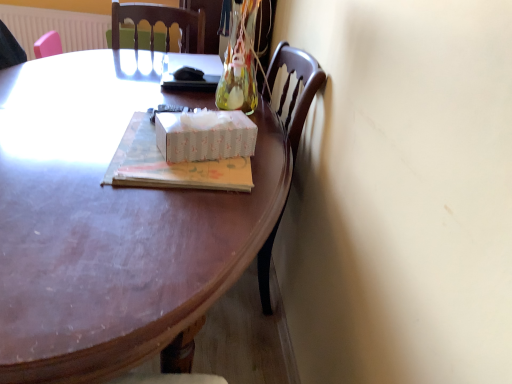
Question: Is matte cardboard book at center wider than wooden desk at center?

Choices:
 (A) no
 (B) yes

Answer: (A)

Question: From a real-world perspective, does matte cardboard book at center stand above wooden desk at center?

Choices:
 (A) no
 (B) yes

Answer: (B)

Question: Is matte cardboard book at center facing away from wooden desk at center?

Choices:
 (A) no
 (B) yes

Answer: (A)

Question: Is wooden desk at center located within matte cardboard book at center?

Choices:
 (A) no
 (B) yes

Answer: (A)

Question: Is matte cardboard book at center positioned behind wooden desk at center?

Choices:
 (A) yes
 (B) no

Answer: (A)

Question: From the image's perspective, is matte cardboard book at center over wooden desk at center?

Choices:
 (A) yes
 (B) no

Answer: (A)

Question: Is white plastic radiator at upper left not near wooden desk at center?

Choices:
 (A) no
 (B) yes

Answer: (B)

Question: Is wooden desk at center completely or partially inside white plastic radiator at upper left?

Choices:
 (A) yes
 (B) no

Answer: (B)

Question: Considering the relative sizes of white plastic radiator at upper left and wooden desk at center in the image provided, is white plastic radiator at upper left wider than wooden desk at center?

Choices:
 (A) yes
 (B) no

Answer: (B)

Question: Is the surface of white plastic radiator at upper left in direct contact with wooden desk at center?

Choices:
 (A) yes
 (B) no

Answer: (B)

Question: Can you confirm if white plastic radiator at upper left is shorter than wooden desk at center?

Choices:
 (A) yes
 (B) no

Answer: (A)

Question: Is white plastic radiator at upper left to the left of wooden desk at center from the viewer's perspective?

Choices:
 (A) no
 (B) yes

Answer: (B)

Question: Can you confirm if matte cardboard book at center is taller than white plastic radiator at upper left?

Choices:
 (A) yes
 (B) no

Answer: (B)